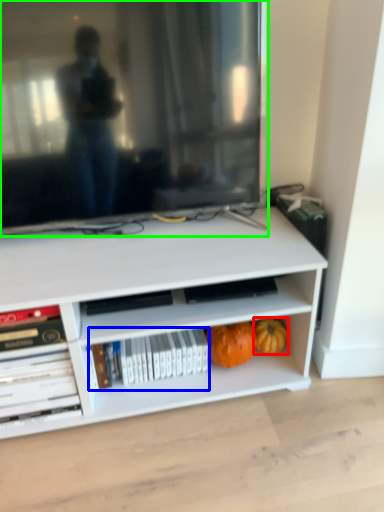
Question: Which is farther away from pumpkin (highlighted by a red box)? book (highlighted by a blue box) or television (highlighted by a green box)?

Choices:
 (A) book
 (B) television

Answer: (B)